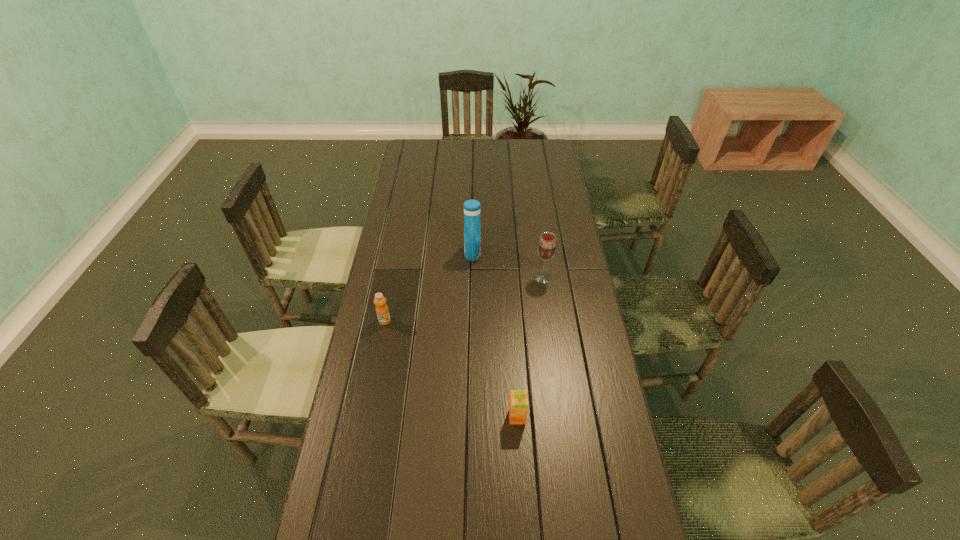
What are the coordinates of `vacant space situated on the front label of the second nearest object` in the screenshot? It's located at (379, 350).

Locate an element on the screen. This screenshot has height=540, width=960. free point located 0.250m on the right of the nearer orange juice is located at coordinates (614, 417).

Locate an element on the screen. object at the left edge is located at coordinates (382, 311).

You are a GUI agent. You are given a task and a screenshot of the screen. Output one action in this format:
    pyautogui.click(x=<x>, y=<y>)
    Task: Click on the object that is positioned at the right edge
    
    Given the screenshot: What is the action you would take?
    pyautogui.click(x=547, y=246)

Identify the location of vacant space at the far edge. (504, 162).

This screenshot has height=540, width=960. I want to click on vacant space at the left edge of the desktop, so click(x=403, y=233).

This screenshot has height=540, width=960. In the image, there is a desktop. Identify the location of vacant space at the right edge. 637,523.

Locate an element on the screen. free point between the nearest object and the left orange juice is located at coordinates coord(451,369).

Where is `free space between the third farthest object and the third object from right to left`? The height and width of the screenshot is (540, 960). free space between the third farthest object and the third object from right to left is located at coordinates (429, 287).

The image size is (960, 540). Find the location of `free space between the third farthest object and the second tallest object`. free space between the third farthest object and the second tallest object is located at coordinates pyautogui.click(x=464, y=299).